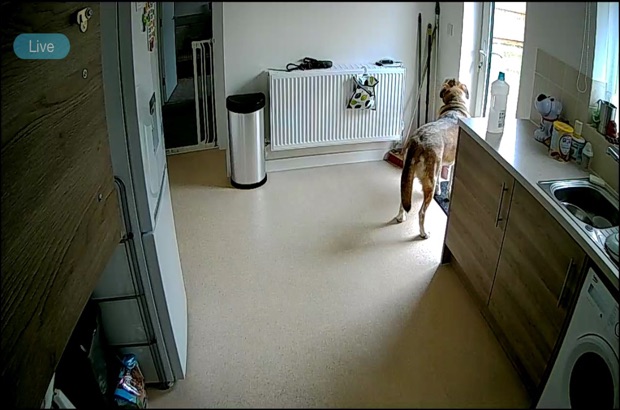
Where is `cabinets`? The height and width of the screenshot is (410, 620). cabinets is located at coordinates (480, 228), (518, 290).